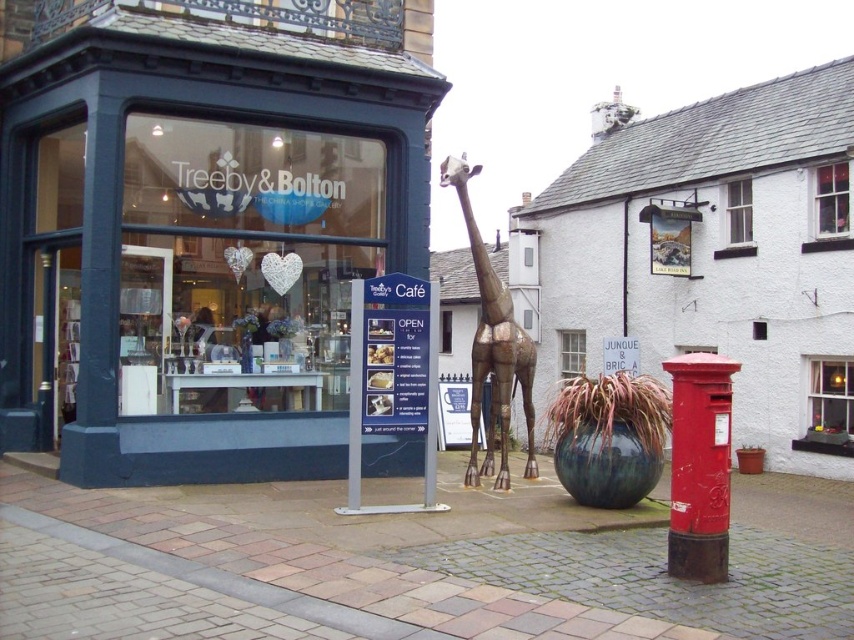
Which is more to the right, matte glass shop window at center or metallic gold giraffe at center?

metallic gold giraffe at center

Who is more distant from viewer, (326, 360) or (484, 369)?

Point (326, 360)

Find the location of a particular element. matte glass shop window at center is located at coordinates (243, 262).

Is matte blue storefront at center bigger than matte glass shop window at center?

Actually, matte blue storefront at center might be smaller than matte glass shop window at center.

Which of these two, matte blue storefront at center or matte glass shop window at center, stands taller?

Standing taller between the two is matte glass shop window at center.

Between point (171, 449) and point (346, 204), which one is positioned behind?

Positioned behind is point (346, 204).

Where is `matte blue storefront at center`? The image size is (854, 640). matte blue storefront at center is located at coordinates (200, 227).

Who is higher up, matte blue storefront at center or metallic gold giraffe at center?

matte blue storefront at center

Does matte blue storefront at center have a greater width compared to metallic gold giraffe at center?

No, matte blue storefront at center is not wider than metallic gold giraffe at center.

Where is `matte blue storefront at center`? matte blue storefront at center is located at coordinates (200, 227).